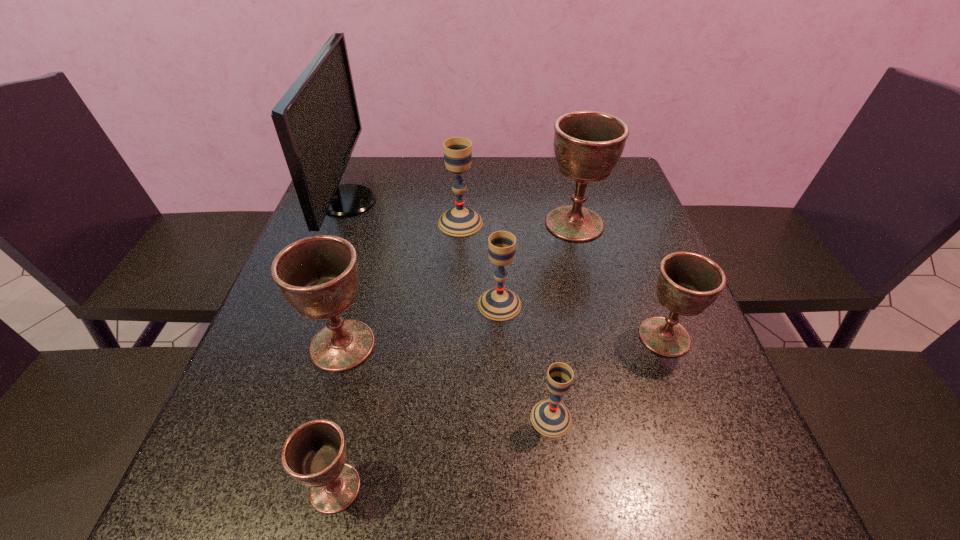
You are a GUI agent. You are given a task and a screenshot of the screen. Output one action in this format:
    pyautogui.click(x=<x>, y=<y>)
    Task: Click on the vacant space at the near left corner
    
    Given the screenshot: What is the action you would take?
    pyautogui.click(x=237, y=515)

Locate an element on the screen. The height and width of the screenshot is (540, 960). free space between the nearest chalice and the tallest chalice is located at coordinates (455, 356).

The width and height of the screenshot is (960, 540). I want to click on free space between the farthest gray chalice and the third smallest brown chalice, so click(x=401, y=284).

This screenshot has height=540, width=960. Identify the location of unoccupied position between the second nearest object and the biggest gray chalice. (506, 320).

Image resolution: width=960 pixels, height=540 pixels. I want to click on free space that is in between the third biggest brown chalice and the second nearest gray chalice, so click(582, 320).

Where is `vacant point located between the second biggest brown chalice and the third biggest brown chalice`? This screenshot has height=540, width=960. vacant point located between the second biggest brown chalice and the third biggest brown chalice is located at coordinates point(503,341).

Identify the location of free space between the nearest object and the third biggest brown chalice. The width and height of the screenshot is (960, 540). (500, 412).

At what (x,y) coordinates should I click in order to perform the action: click on vacant point located between the biggest gray chalice and the tallest object. Please return your answer as a coordinate pair (x, y). Looking at the image, I should click on (404, 212).

Image resolution: width=960 pixels, height=540 pixels. In order to click on free area in between the second smallest brown chalice and the farthest gray chalice in this screenshot , I will do `click(563, 280)`.

What are the coordinates of `unoccupied area between the tallest object and the second nearest chalice` in the screenshot? It's located at (449, 309).